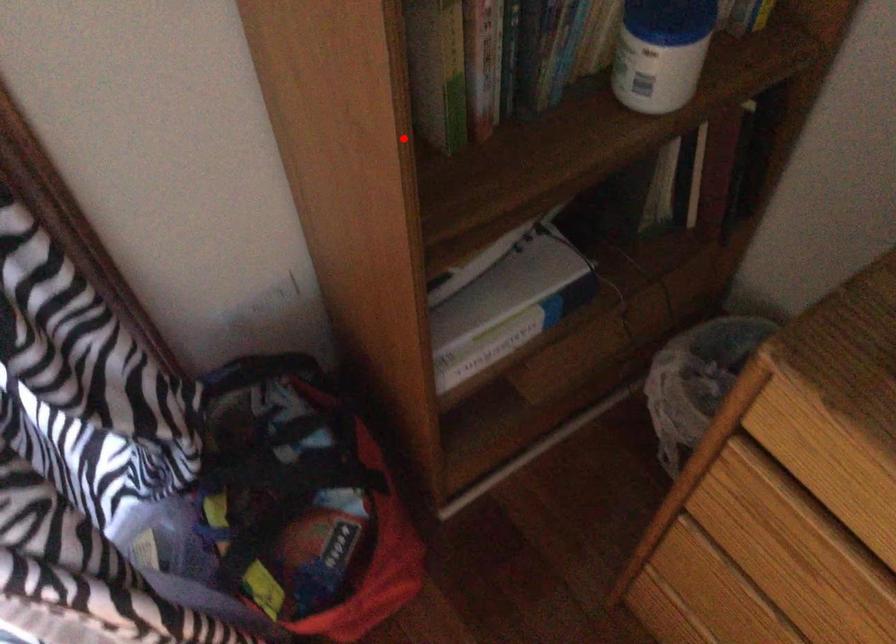
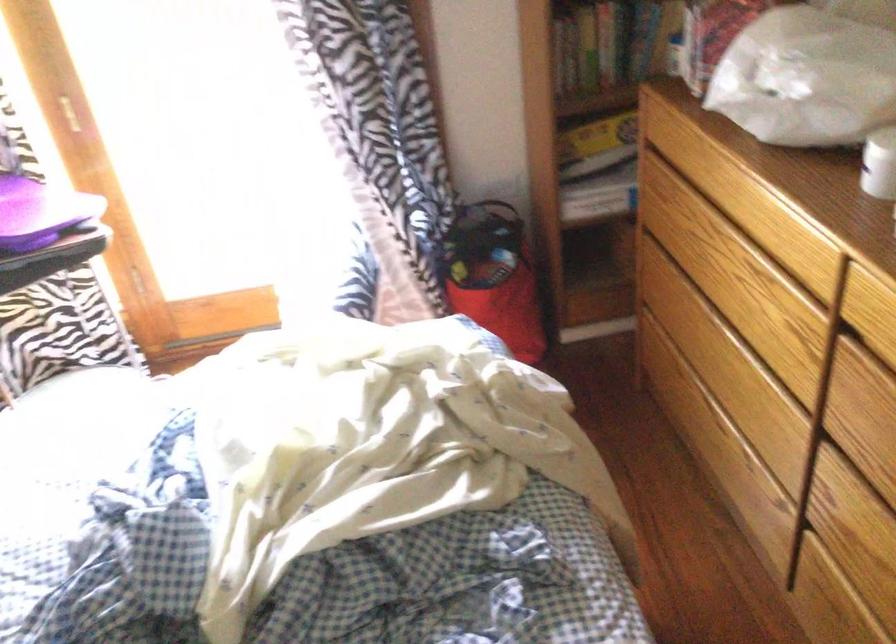
Where in the second image is the point corresponding to the highlighted location from the first image?

(564, 58)